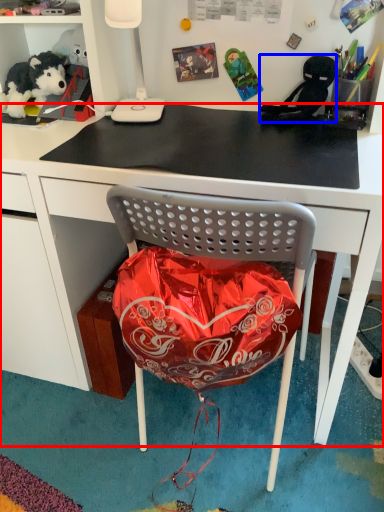
Question: Which of the following is the farthest to the observer, desk (highlighted by a red box) or person (highlighted by a blue box)?

Choices:
 (A) desk
 (B) person

Answer: (B)